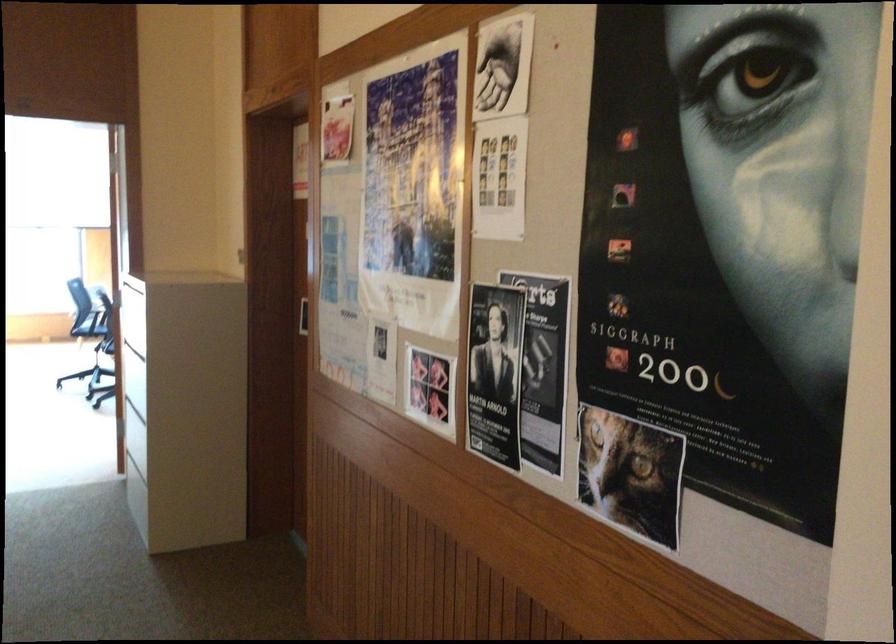
Image resolution: width=896 pixels, height=644 pixels. What do you see at coordinates (106, 301) in the screenshot?
I see `the chair armrest` at bounding box center [106, 301].